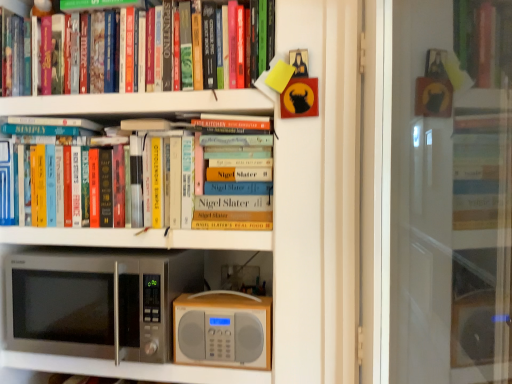
Question: Is wooden radio at center far away from hardcover books at upper left, the first book viewed from the top?

Choices:
 (A) no
 (B) yes

Answer: (A)

Question: Considering the relative sizes of wooden radio at center and hardcover books at upper left, the first book viewed from the top, in the image provided, is wooden radio at center thinner than hardcover books at upper left, the first book viewed from the top,?

Choices:
 (A) no
 (B) yes

Answer: (B)

Question: Can you confirm if wooden radio at center is shorter than hardcover books at upper left, arranged as the 2th book when ordered from the bottom?

Choices:
 (A) yes
 (B) no

Answer: (A)

Question: Is wooden radio at center wider than hardcover books at upper left, the first book viewed from the top?

Choices:
 (A) no
 (B) yes

Answer: (A)

Question: From the image's perspective, is wooden radio at center located beneath hardcover books at upper left, the first book viewed from the top?

Choices:
 (A) no
 (B) yes

Answer: (B)

Question: Is the position of wooden radio at center less distant than that of hardcover books at upper left, the first book viewed from the top?

Choices:
 (A) yes
 (B) no

Answer: (B)

Question: Does wooden radio at center touch hardcover books at center, placed as the 2th book when sorted from top to bottom?

Choices:
 (A) yes
 (B) no

Answer: (B)

Question: From the image's perspective, is wooden radio at center beneath hardcover books at center, positioned as the 1th book in bottom-to-top order?

Choices:
 (A) yes
 (B) no

Answer: (A)

Question: From a real-world perspective, is wooden radio at center located higher than hardcover books at center, positioned as the 1th book in bottom-to-top order?

Choices:
 (A) yes
 (B) no

Answer: (B)

Question: From a real-world perspective, is wooden radio at center located beneath hardcover books at center, positioned as the 1th book in bottom-to-top order?

Choices:
 (A) no
 (B) yes

Answer: (B)

Question: From the image's perspective, is wooden radio at center located above hardcover books at center, positioned as the 1th book in bottom-to-top order?

Choices:
 (A) yes
 (B) no

Answer: (B)

Question: Is hardcover books at center, placed as the 2th book when sorted from top to bottom, at the back of wooden radio at center?

Choices:
 (A) no
 (B) yes

Answer: (A)

Question: Does hardcover books at upper left, arranged as the 2th book when ordered from the bottom, contain satin silver microwave at lower left?

Choices:
 (A) no
 (B) yes

Answer: (A)